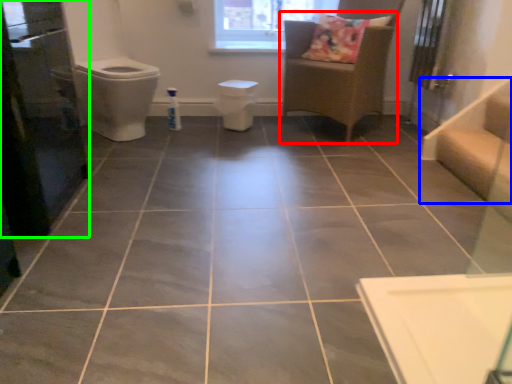
Question: Estimate the real-world distances between objects in this image. Which object is farther from furniture (highlighted by a red box), stairwell (highlighted by a blue box) or screen door (highlighted by a green box)?

Choices:
 (A) stairwell
 (B) screen door

Answer: (B)